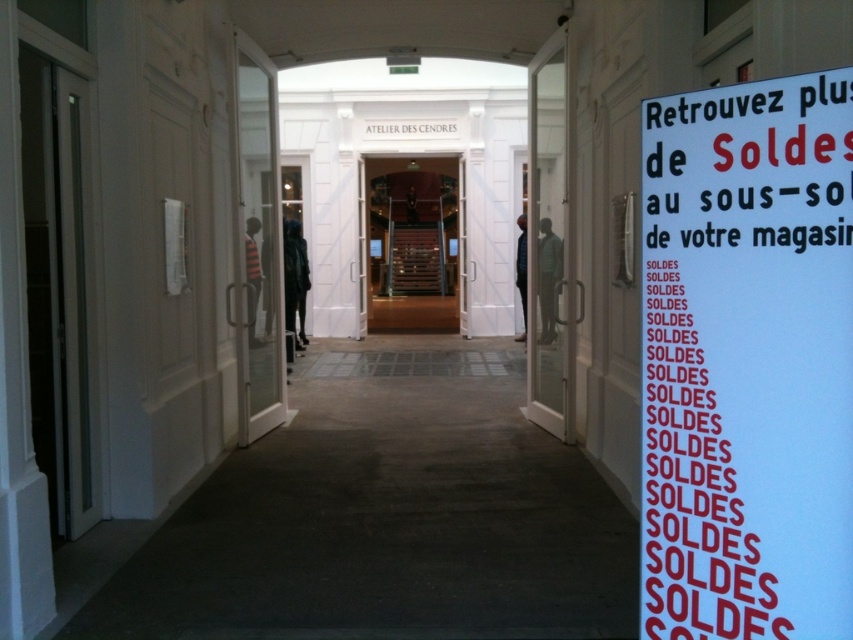
Question: Which of the following is the closest to the observer?

Choices:
 (A) blue paper sign at right
 (B) clear glass door at center

Answer: (A)

Question: Considering the relative positions of blue paper sign at right and wooden stairs at center in the image provided, where is blue paper sign at right located with respect to wooden stairs at center?

Choices:
 (A) below
 (B) above

Answer: (A)

Question: Does transparent glass door at left have a greater width compared to clear glass door at center?

Choices:
 (A) no
 (B) yes

Answer: (A)

Question: Which object appears closest to the camera in this image?

Choices:
 (A) wooden stairs at center
 (B) blue paper sign at right

Answer: (B)

Question: Observing the image, what is the correct spatial positioning of blue paper sign at right in reference to transparent glass door at left?

Choices:
 (A) below
 (B) above

Answer: (A)

Question: Which of these objects is positioned farthest from the wooden stairs at center?

Choices:
 (A) transparent glass door at left
 (B) blue paper sign at right
 (C) clear glass door at center

Answer: (B)